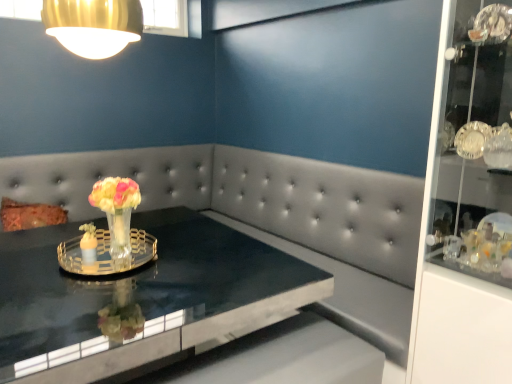
Identify the location of translucent glass vase at center. (117, 213).

Where is `clear glass tray at center`? The width and height of the screenshot is (512, 384). clear glass tray at center is located at coordinates (106, 254).

Image resolution: width=512 pixels, height=384 pixels. In order to click on black glossy table at center in this screenshot , I will do `click(140, 297)`.

In order to click on translucent glass vase at center in this screenshot , I will do `click(117, 213)`.

Who is bigger, clear glass tray at center or translucent glass vase at center?

Bigger between the two is translucent glass vase at center.

Choose the correct answer: Is clear glass tray at center inside translucent glass vase at center or outside it?

clear glass tray at center is outside translucent glass vase at center.

At what (x,y) coordinates should I click in order to perform the action: click on glass plate located on the left of translucent glass vase at center. Please return your answer as a coordinate pair (x, y). Looking at the image, I should click on (106, 254).

Is clear glass tray at center far away from translucent glass vase at center?

clear glass tray at center is near translucent glass vase at center, not far away.

Where is `lamp above the clear glass tray at center (from the image's perspective)`? Image resolution: width=512 pixels, height=384 pixels. lamp above the clear glass tray at center (from the image's perspective) is located at coordinates (93, 25).

In terms of width, does gold metallic lampshade at upper left look wider or thinner when compared to clear glass tray at center?

Clearly, gold metallic lampshade at upper left has less width compared to clear glass tray at center.

Is point (132, 34) positioned in front of point (97, 254)?

Yes, it is in front of point (97, 254).

Looking at this image, how different are the orientations of black glossy table at center and gold metallic lampshade at upper left in degrees?

They differ by 2.6 degrees in their facing directions.

Which point is more distant from viewer, (199, 225) or (82, 41)?

The point (199, 225) is farther.

Which object is wider, black glossy table at center or gold metallic lampshade at upper left?

black glossy table at center.

Is black glossy table at center positioned beyond the bounds of gold metallic lampshade at upper left?

Absolutely, black glossy table at center is external to gold metallic lampshade at upper left.

Does black glossy table at center have a lesser width compared to translucent glass vase at center?

No.

Which is more to the right, black glossy table at center or translucent glass vase at center?

From the viewer's perspective, black glossy table at center appears more on the right side.

From a real-world perspective, which is physically below, black glossy table at center or translucent glass vase at center?

In real-world perspective, black glossy table at center is lower.

Is point (99, 272) less distant than point (61, 16)?

No, (99, 272) is behind (61, 16).

Can you confirm if clear glass tray at center is shorter than gold metallic lampshade at upper left?

Yes.

From the image's perspective, which object appears higher, gold metallic lampshade at upper left or translucent glass vase at center?

gold metallic lampshade at upper left appears higher in the image.

Does gold metallic lampshade at upper left have a larger size compared to translucent glass vase at center?

Yes.

How different are the orientations of gold metallic lampshade at upper left and translucent glass vase at center in degrees?

The angular difference between gold metallic lampshade at upper left and translucent glass vase at center is 10.1 degrees.

Locate an element on the screen. This screenshot has height=384, width=512. lamp above the translucent glass vase at center (from a real-world perspective) is located at coordinates (93, 25).

From the image's perspective, is black glossy table at center above or below clear glass tray at center?

From the image's perspective, black glossy table at center appears below clear glass tray at center.

Based on their sizes in the image, would you say black glossy table at center is bigger or smaller than clear glass tray at center?

Clearly, black glossy table at center is larger in size than clear glass tray at center.

Considering the relative positions of black glossy table at center and clear glass tray at center in the image provided, is black glossy table at center to the right of clear glass tray at center from the viewer's perspective?

Correct, you'll find black glossy table at center to the right of clear glass tray at center.

Identify the location of floral arrangement located behind the clear glass tray at center. (117, 213).

Image resolution: width=512 pixels, height=384 pixels. I want to click on lamp above the clear glass tray at center (from a real-world perspective), so click(93, 25).

Based on the photo, considering their positions, is clear glass tray at center positioned further to gold metallic lampshade at upper left than black glossy table at center?

black glossy table at center lies further to gold metallic lampshade at upper left than the other object.

Looking at the image, which one is located further to translucent glass vase at center, gold metallic lampshade at upper left or black glossy table at center?

gold metallic lampshade at upper left is further to translucent glass vase at center.

Considering their positions, is clear glass tray at center positioned closer to translucent glass vase at center than gold metallic lampshade at upper left?

clear glass tray at center is closer to translucent glass vase at center.

Estimate the real-world distances between objects in this image. Which object is closer to black glossy table at center, translucent glass vase at center or clear glass tray at center?

clear glass tray at center lies closer to black glossy table at center than the other object.

Considering their positions, is translucent glass vase at center positioned further to clear glass tray at center than black glossy table at center?

black glossy table at center is positioned further to the anchor clear glass tray at center.

Looking at the image, which one is located further to black glossy table at center, clear glass tray at center or translucent glass vase at center?

translucent glass vase at center.

Looking at the image, which one is located further to black glossy table at center, gold metallic lampshade at upper left or clear glass tray at center?

gold metallic lampshade at upper left lies further to black glossy table at center than the other object.

Considering their positions, is black glossy table at center positioned closer to gold metallic lampshade at upper left than clear glass tray at center?

clear glass tray at center is closer to gold metallic lampshade at upper left.

Identify the location of glass plate that lies between gold metallic lampshade at upper left and black glossy table at center from top to bottom. This screenshot has width=512, height=384. (106, 254).

Image resolution: width=512 pixels, height=384 pixels. I want to click on glass plate located between black glossy table at center and translucent glass vase at center in the depth direction, so click(x=106, y=254).

Identify the location of floral arrangement between gold metallic lampshade at upper left and black glossy table at center vertically. (117, 213).

Locate an element on the screen. floral arrangement between gold metallic lampshade at upper left and clear glass tray at center vertically is located at coordinates (117, 213).